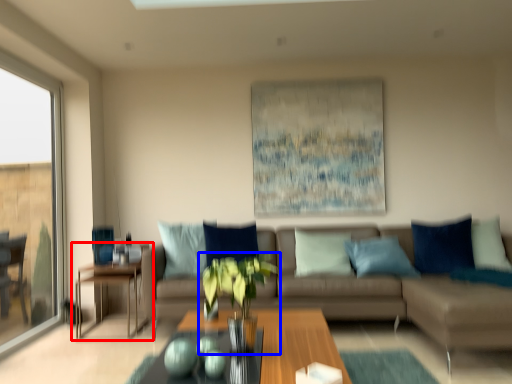
Question: Among these objects, which one is farthest to the camera, table (highlighted by a red box) or houseplant (highlighted by a blue box)?

Choices:
 (A) table
 (B) houseplant

Answer: (A)